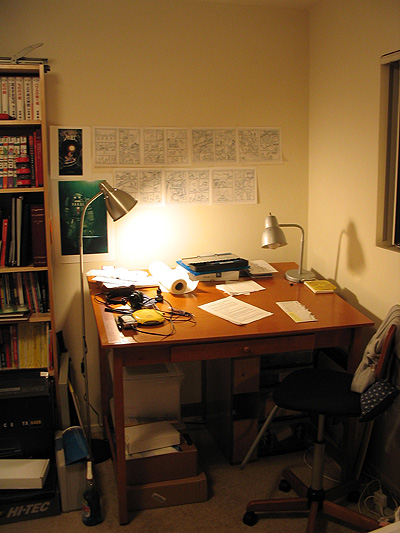
Identify the location of desk chair. The height and width of the screenshot is (533, 400). (329, 401).